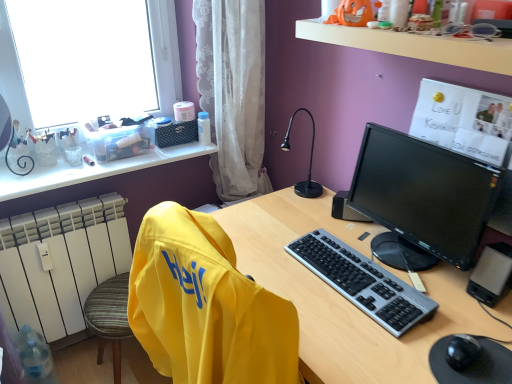
Where is `free space in front of black plastic speaker at right`? The height and width of the screenshot is (384, 512). free space in front of black plastic speaker at right is located at coordinates (362, 233).